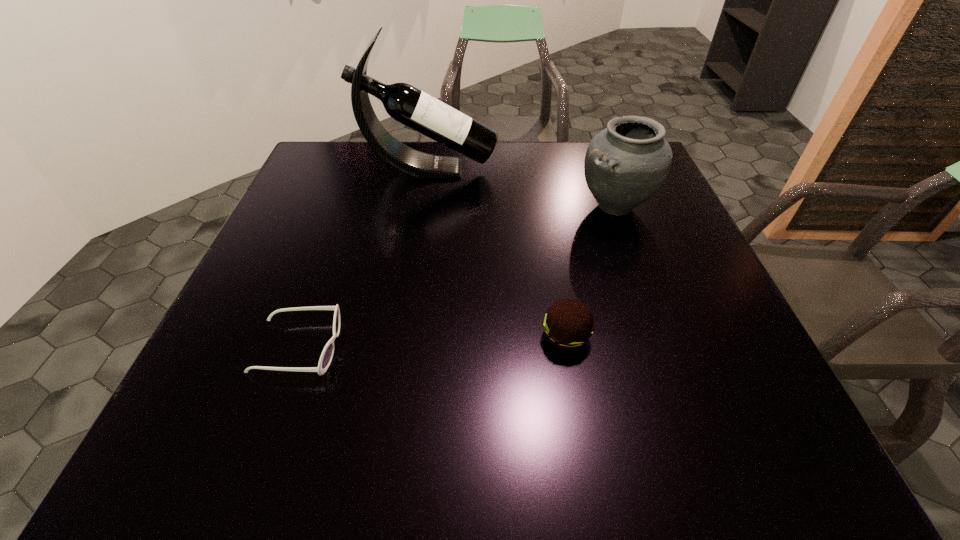
Identify the location of free space between the shortest object and the patty. The height and width of the screenshot is (540, 960). (432, 342).

Identify the location of free space between the farthest object and the third shortest object. (522, 188).

At what (x,y) coordinates should I click in order to perform the action: click on unoccupied position between the wine bottle and the third object from left to right. Please return your answer as a coordinate pair (x, y). Looking at the image, I should click on (497, 253).

This screenshot has height=540, width=960. Identify the location of object that is the second closest to the third nearest object. point(568,324).

At what (x,y) coordinates should I click in order to perform the action: click on object that stands as the closest to the patty. Please return your answer as a coordinate pair (x, y). Looking at the image, I should click on (626, 164).

Identify the location of vacant space that satisfies the following two spatial constraints: 1. on the stand of the third shortest object; 2. on the right side of the tallest object. Image resolution: width=960 pixels, height=540 pixels. (423, 207).

The width and height of the screenshot is (960, 540). I want to click on vacant space that satisfies the following two spatial constraints: 1. on the stand of the third tallest object; 2. on the right side of the tallest object, so click(x=403, y=336).

Locate an element on the screen. The width and height of the screenshot is (960, 540). free space that satisfies the following two spatial constraints: 1. on the back side of the rightmost object; 2. on the stand of the wine bottle is located at coordinates (602, 169).

At what (x,y) coordinates should I click in order to perform the action: click on free spot that satisfies the following two spatial constraints: 1. on the stand of the second tallest object; 2. on the right side of the wine bottle. Please return your answer as a coordinate pair (x, y). This screenshot has width=960, height=540. Looking at the image, I should click on (423, 207).

At what (x,y) coordinates should I click in order to perform the action: click on free space that satisfies the following two spatial constraints: 1. on the front side of the second object from right to left; 2. with the lenses of the shortest object facing outward. Please return your answer as a coordinate pair (x, y). This screenshot has height=540, width=960. Looking at the image, I should click on (567, 347).